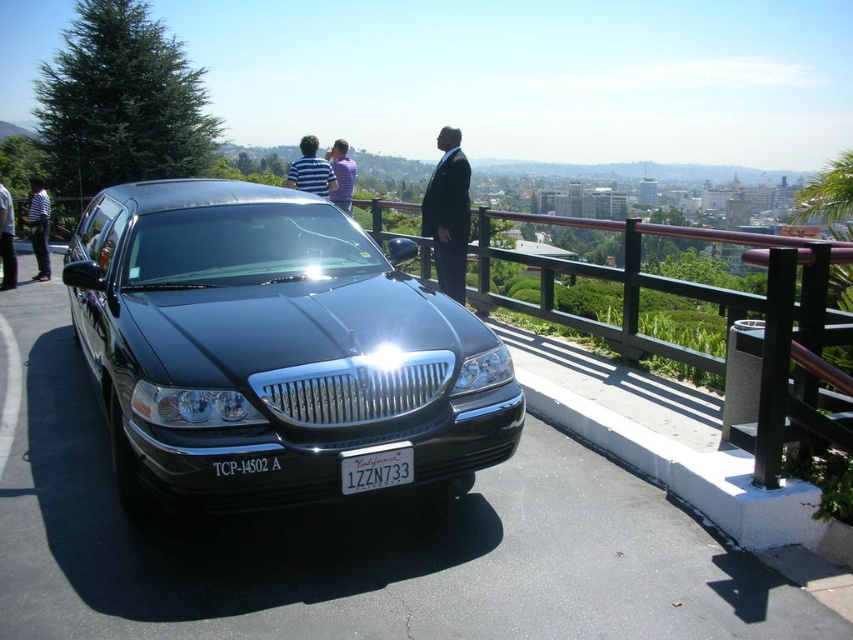
You are a fashion designer observing the striped fabric shirt at upper center and the dark gray suit at center in the image. Which clothing item has a greater width?

The striped fabric shirt at upper center has a greater width than the dark gray suit at center.

You are standing at the overlook near the black Lincoln Town Car. You see the striped fabric shirt at upper center. Can you reach it without moving from your current position?

The striped fabric shirt at upper center is 8.46 meters away from the viewer, so it is too far to reach without moving from the current position.

In the scene shown: You are a photographer standing in front of the black Lincoln Town Car. You notice a striped shirt at left and a dark gray suit at center in the scene. Which one is closer to the camera?

The striped shirt at left is closer to the camera because the dark gray suit at center is behind it.